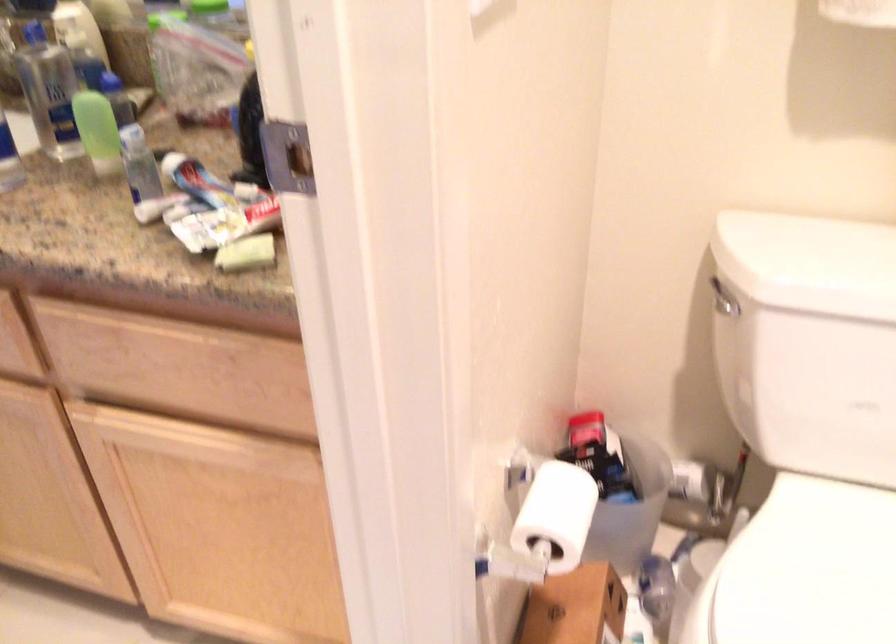
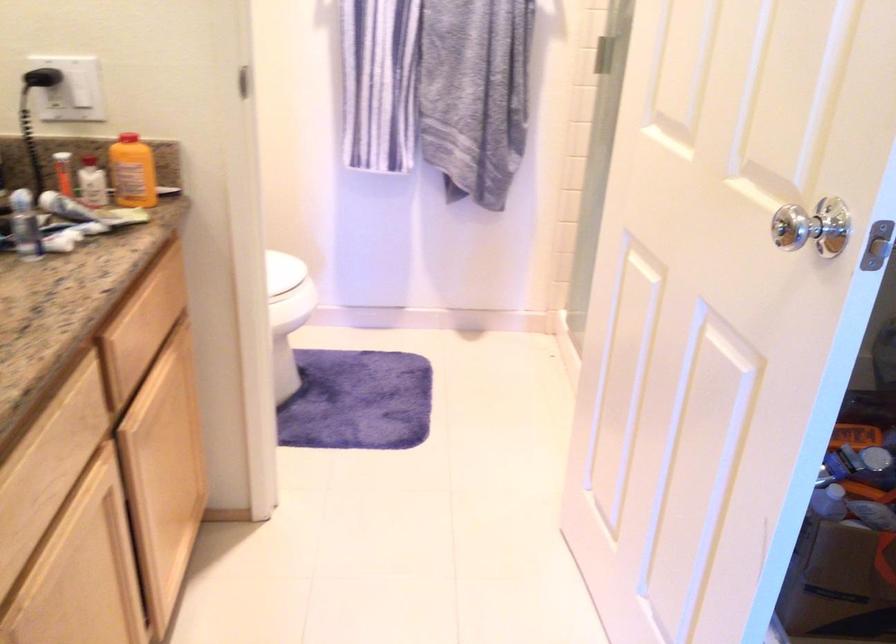
Question: I am providing you with two images of the same scene from different viewpoints. After the viewpoint changes to image2, which objects are now occluded?

Choices:
 (A) metal ladder step
 (B) silver door knob
 (C) white bottle
 (D) small cardboard box

Answer: (D)